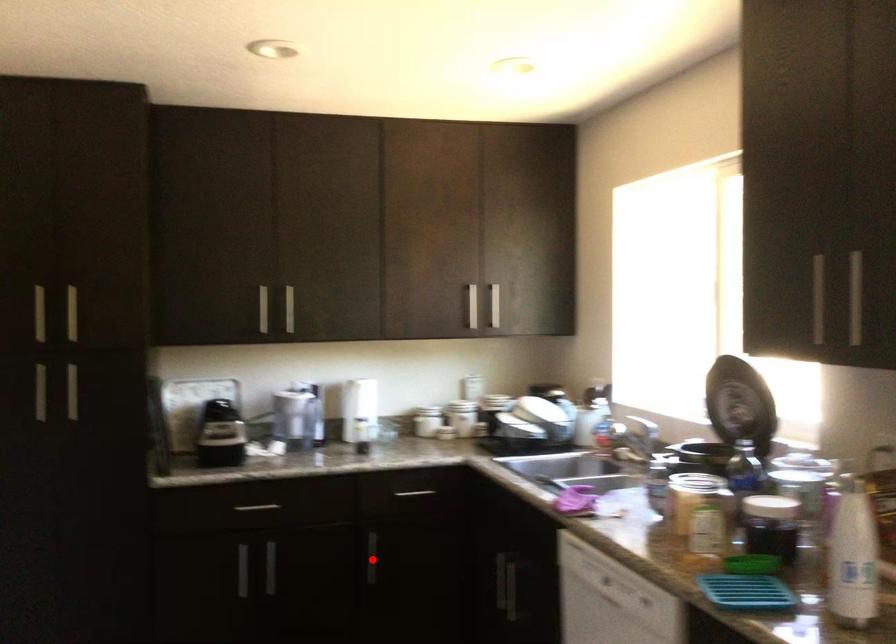
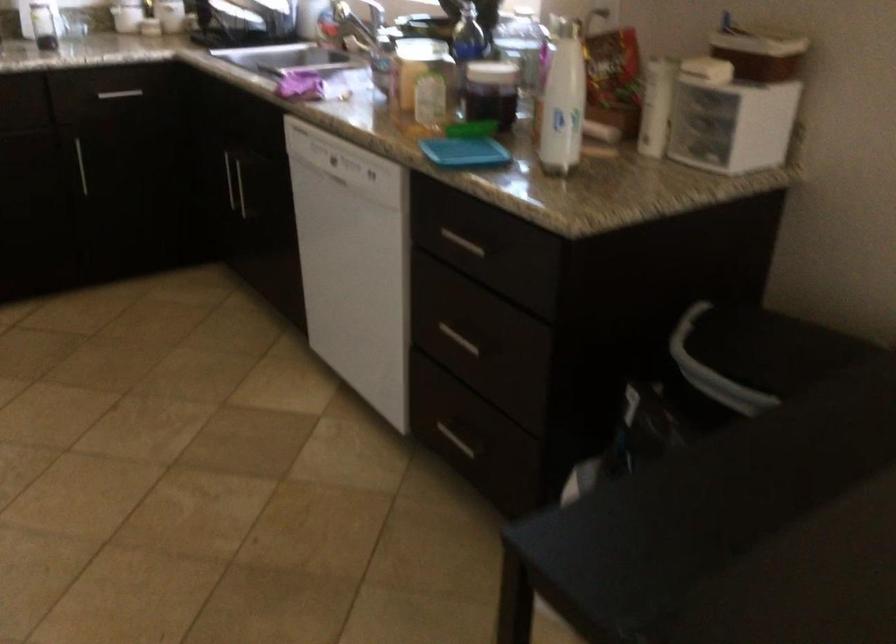
Locate, in the second image, the point that corresponds to the highlighted location in the first image.

(81, 166)